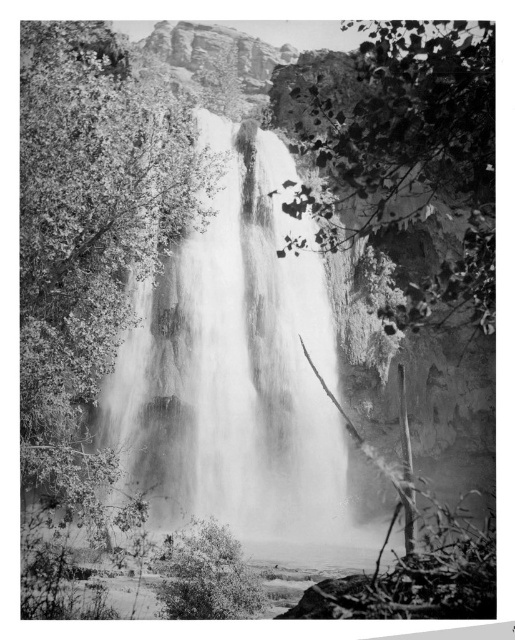
Question: Does smooth white water at center appear under smooth green tree at center?

Choices:
 (A) no
 (B) yes

Answer: (B)

Question: Does smooth white water at center have a lesser width compared to leaves at center?

Choices:
 (A) no
 (B) yes

Answer: (A)

Question: Is smooth white water at center positioned before leaves at center?

Choices:
 (A) no
 (B) yes

Answer: (B)

Question: Which object appears closest to the camera in this image?

Choices:
 (A) smooth green tree at center
 (B) leaves at center

Answer: (A)

Question: Which point is closer to the camera?

Choices:
 (A) (482, 273)
 (B) (104, 259)

Answer: (B)

Question: Which point is farther to the camera?

Choices:
 (A) smooth white water at center
 (B) leaves at center

Answer: (B)